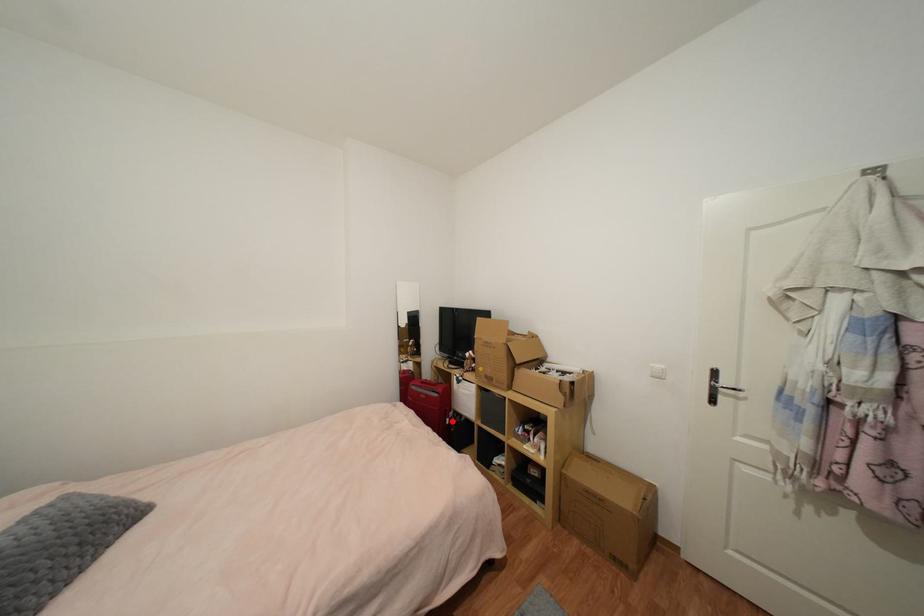
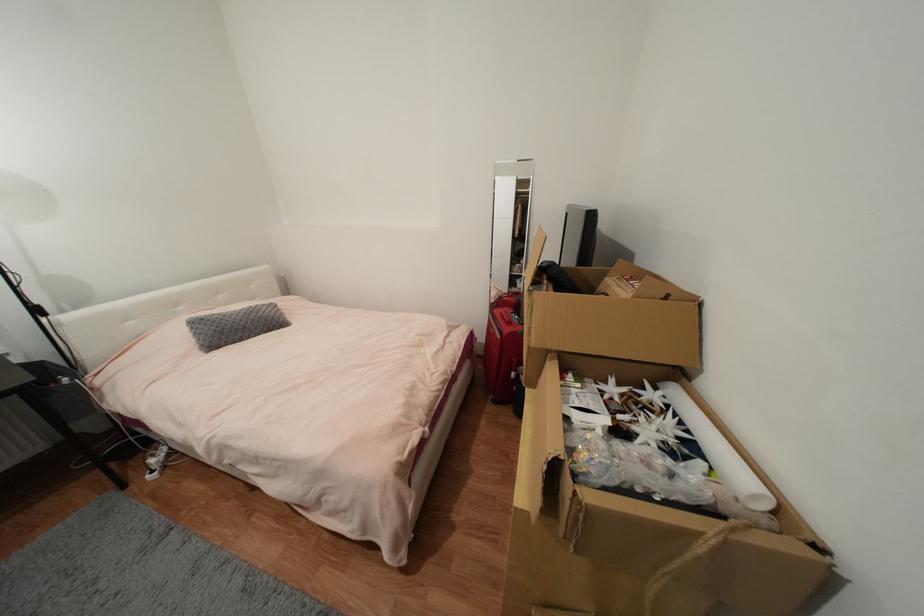
Question: I am providing you with two images of the same scene from different viewpoints. In image1, a red point is highlighted. Considering the same 3D point in image2, which of the following is correct?

Choices:
 (A) It is closer
 (B) It is farther

Answer: (A)